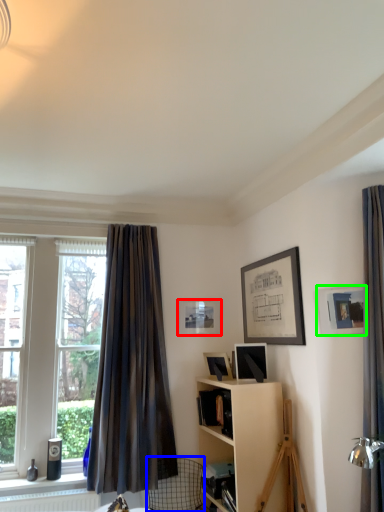
Question: Which is nearer to the picture frame (highlighted by a red box)? swivel chair (highlighted by a blue box) or picture frame (highlighted by a green box).

Choices:
 (A) swivel chair
 (B) picture frame

Answer: (A)